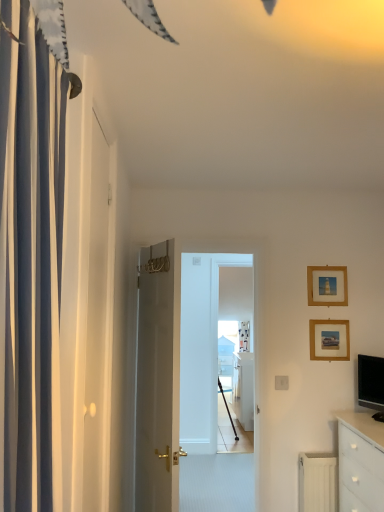
The image size is (384, 512). What do you see at coordinates (243, 389) in the screenshot? I see `white glossy cabinet at center` at bounding box center [243, 389].

This screenshot has width=384, height=512. Describe the element at coordinates (327, 286) in the screenshot. I see `wooden picture frame at upper right, the 2th picture frame in the bottom-to-top sequence` at that location.

What do you see at coordinates (329, 340) in the screenshot?
I see `wooden picture frame at upper right, which is the 2th picture frame from top to bottom` at bounding box center [329, 340].

The width and height of the screenshot is (384, 512). What do you see at coordinates (371, 384) in the screenshot?
I see `matte black tv at right` at bounding box center [371, 384].

This screenshot has height=512, width=384. What do you see at coordinates (318, 482) in the screenshot?
I see `white matte radiator at lower right` at bounding box center [318, 482].

Measure the distance between point (142,430) and camera.

Point (142,430) and camera are 2.59 meters apart.

Locate an element on the screen. white matte door at left is located at coordinates (99, 318).

From the image's perspective, between matte black tv at right and white glossy cabinet at center, which one is located above?

From the image's view, matte black tv at right is above.

Which is more to the left, matte black tv at right or white glossy cabinet at center?

From the viewer's perspective, white glossy cabinet at center appears more on the left side.

Does matte black tv at right turn towards white glossy cabinet at center?

No, matte black tv at right is not turned towards white glossy cabinet at center.

Which of these two, matte black tv at right or white glossy cabinet at center, is smaller?

matte black tv at right is smaller.

Is wooden picture frame at upper right, the 2th picture frame in the bottom-to-top sequence, far from white matte door at left?

Yes.

Is white matte door at left completely or partially inside wooden picture frame at upper right, arranged as the first picture frame when viewed from the top?

No, white matte door at left is not inside wooden picture frame at upper right, arranged as the first picture frame when viewed from the top.

Starting from the white matte door at left, which picture frame is the 1st one to the right? Please provide its 2D coordinates.

[(327, 286)]

Considering the relative sizes of wooden picture frame at upper right, the 2th picture frame in the bottom-to-top sequence, and white matte door at left in the image provided, is wooden picture frame at upper right, the 2th picture frame in the bottom-to-top sequence, wider than white matte door at left?

Incorrect, the width of wooden picture frame at upper right, the 2th picture frame in the bottom-to-top sequence, does not surpass that of white matte door at left.

Between wooden picture frame at upper right, arranged as the first picture frame when viewed from the top, and white striped curtain at left, which one appears on the right side from the viewer's perspective?

wooden picture frame at upper right, arranged as the first picture frame when viewed from the top.

From the image's perspective, which one is positioned higher, wooden picture frame at upper right, the 2th picture frame in the bottom-to-top sequence, or white striped curtain at left?

white striped curtain at left, from the image's perspective.

Does wooden picture frame at upper right, arranged as the first picture frame when viewed from the top, have a lesser height compared to white striped curtain at left?

Indeed, wooden picture frame at upper right, arranged as the first picture frame when viewed from the top, has a lesser height compared to white striped curtain at left.

Is wooden picture frame at upper right, the 2th picture frame in the bottom-to-top sequence, looking in the opposite direction of white striped curtain at left?

No, wooden picture frame at upper right, the 2th picture frame in the bottom-to-top sequence, is not facing away from white striped curtain at left.

Is white striped curtain at left next to matte black tv at right?

No, white striped curtain at left is not making contact with matte black tv at right.

Does white striped curtain at left turn towards matte black tv at right?

No, white striped curtain at left does not turn towards matte black tv at right.

Which object is thinner, white striped curtain at left or matte black tv at right?

Thinner between the two is matte black tv at right.

In the image, is white striped curtain at left positioned in front of or behind matte black tv at right?

white striped curtain at left is in front of matte black tv at right.

Is white glossy chest of drawers at lower right aimed at white glossy screen door at center?

Yes, white glossy chest of drawers at lower right is turned towards white glossy screen door at center.

Considering the sizes of objects white glossy chest of drawers at lower right and white glossy screen door at center in the image provided, who is thinner, white glossy chest of drawers at lower right or white glossy screen door at center?

white glossy screen door at center is thinner.

I want to click on screen door above the white glossy chest of drawers at lower right (from a real-world perspective), so click(201, 346).

Are white glossy chest of drawers at lower right and white glossy screen door at center beside each other?

white glossy chest of drawers at lower right and white glossy screen door at center are not in contact.

Looking at this image, does white glossy door at center turn towards white matte radiator at lower right?

Yes, white glossy door at center is oriented towards white matte radiator at lower right.

From a real-world perspective, is white glossy door at center located beneath white matte radiator at lower right?

Actually, white glossy door at center is physically above white matte radiator at lower right in the real world.

Can you confirm if white glossy cabinet at center is wider than white glossy screen door at center?

Yes, white glossy cabinet at center is wider than white glossy screen door at center.

Is white glossy cabinet at center positioned before white glossy screen door at center?

That is False.

Is white glossy cabinet at center oriented towards white glossy screen door at center?

No, white glossy cabinet at center does not turn towards white glossy screen door at center.

From a real-world perspective, is white glossy cabinet at center physically located above or below white glossy screen door at center?

white glossy cabinet at center is below white glossy screen door at center.

Where is `television above the white glossy cabinet at center (from a real-world perspective)`? The image size is (384, 512). television above the white glossy cabinet at center (from a real-world perspective) is located at coordinates (371, 384).

Where is `shutter below the wooden picture frame at upper right, the 2th picture frame in the bottom-to-top sequence (from the image's perspective)`? Image resolution: width=384 pixels, height=512 pixels. shutter below the wooden picture frame at upper right, the 2th picture frame in the bottom-to-top sequence (from the image's perspective) is located at coordinates (99, 318).

Looking at the image, which one is located further to white matte door at left, wooden picture frame at upper right, the 2th picture frame in the bottom-to-top sequence, or white matte radiator at lower right?

The object further to white matte door at left is white matte radiator at lower right.

Looking at the image, which one is located closer to white matte door at left, matte black tv at right or white glossy chest of drawers at lower right?

white glossy chest of drawers at lower right is positioned closer to the anchor white matte door at left.

Consider the image. Which object lies further to the anchor point white glossy screen door at center, white striped curtain at left or white matte radiator at lower right?

white striped curtain at left is positioned further to the anchor white glossy screen door at center.

Considering their positions, is white matte radiator at lower right positioned closer to white glossy screen door at center than wooden picture frame at upper right, the 2th picture frame in the bottom-to-top sequence?

wooden picture frame at upper right, the 2th picture frame in the bottom-to-top sequence, lies closer to white glossy screen door at center than the other object.

Considering their positions, is white matte radiator at lower right positioned further to white matte door at left than white glossy door at center?

white matte radiator at lower right.

Based on their spatial positions, is matte black tv at right or white striped curtain at left further from wooden picture frame at upper right, the 2th picture frame in the bottom-to-top sequence?

Based on the image, white striped curtain at left appears to be further to wooden picture frame at upper right, the 2th picture frame in the bottom-to-top sequence.

Which object lies further to the anchor point white glossy cabinet at center, white glossy chest of drawers at lower right or matte black tv at right?

white glossy chest of drawers at lower right lies further to white glossy cabinet at center than the other object.

Estimate the real-world distances between objects in this image. Which object is further from white glossy cabinet at center, white glossy chest of drawers at lower right or white glossy door at center?

Among the two, white glossy door at center is located further to white glossy cabinet at center.

At what (x,y) coordinates should I click in order to perform the action: click on chest of drawers between white striped curtain at left and white glossy screen door at center from front to back. Please return your answer as a coordinate pair (x, y). The width and height of the screenshot is (384, 512). Looking at the image, I should click on (360, 464).

I want to click on door between wooden picture frame at upper right, the 2th picture frame in the bottom-to-top sequence, and white matte radiator at lower right, in the vertical direction, so click(157, 380).

Identify the location of door positioned between white striped curtain at left and wooden picture frame at upper right, arranged as the first picture frame when viewed from the top, from near to far. (157, 380).

Identify the location of chest of drawers between wooden picture frame at upper right, arranged as the first picture frame when viewed from the top, and white matte radiator at lower right from top to bottom. (360, 464).